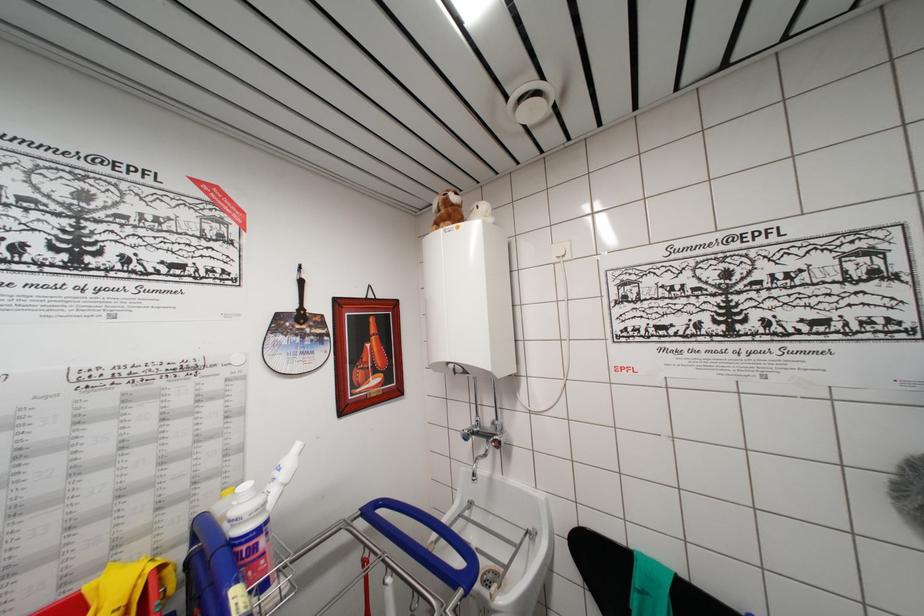
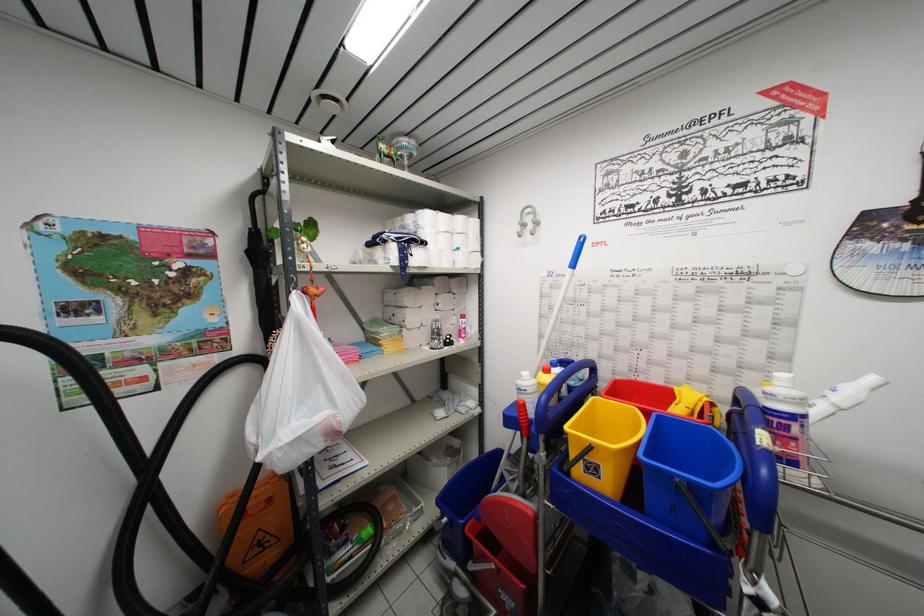
In the second image, find the point that corresponds to (x=290, y=490) in the first image.

(845, 415)